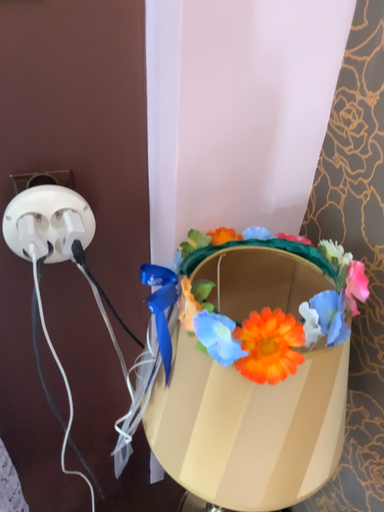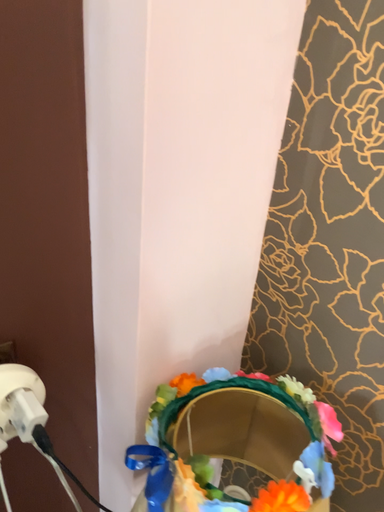
Question: How did the camera likely rotate when shooting the video?

Choices:
 (A) rotated downward
 (B) rotated upward

Answer: (B)